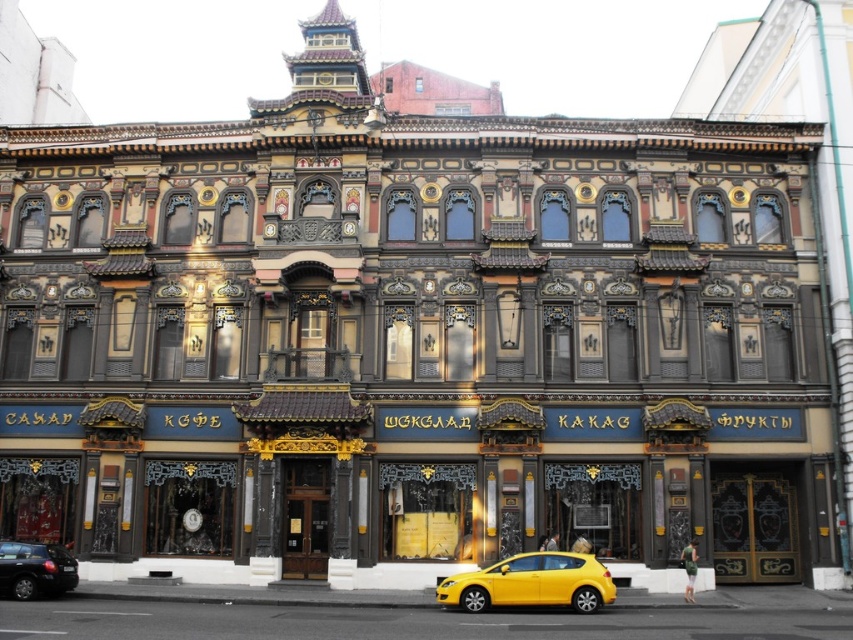
In the scene shown: Does metallic yellow car at lower center appear under black matte car at lower left?

Yes, metallic yellow car at lower center is below black matte car at lower left.

Which is below, metallic yellow car at lower center or black matte car at lower left?

metallic yellow car at lower center

Describe the element at coordinates (531, 582) in the screenshot. I see `metallic yellow car at lower center` at that location.

Where is `metallic yellow car at lower center`? Image resolution: width=853 pixels, height=640 pixels. metallic yellow car at lower center is located at coordinates (531, 582).